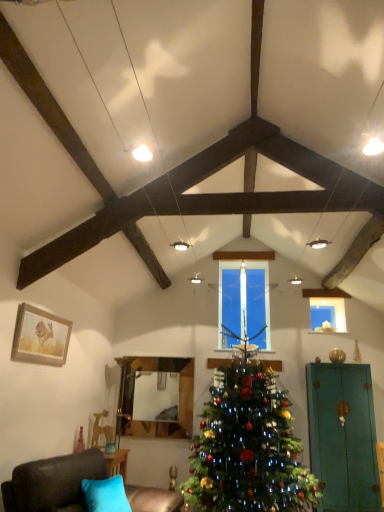
Question: From the image's perspective, is green matte christmas tree at center on transparent glass candle at upper center?

Choices:
 (A) yes
 (B) no

Answer: (B)

Question: Is transparent glass candle at upper center at the back of green matte christmas tree at center?

Choices:
 (A) no
 (B) yes

Answer: (A)

Question: Would you say green matte christmas tree at center is a long distance from transparent glass candle at upper center?

Choices:
 (A) yes
 (B) no

Answer: (A)

Question: Is green matte christmas tree at center taller than transparent glass candle at upper center?

Choices:
 (A) no
 (B) yes

Answer: (B)

Question: From a real-world perspective, is green matte christmas tree at center over transparent glass candle at upper center?

Choices:
 (A) no
 (B) yes

Answer: (A)

Question: Does green matte christmas tree at center have a smaller size compared to transparent glass candle at upper center?

Choices:
 (A) no
 (B) yes

Answer: (A)

Question: Can you confirm if teal matte armoire at right is positioned to the right of transparent glass candle at upper center?

Choices:
 (A) yes
 (B) no

Answer: (B)

Question: Is teal matte armoire at right facing towards transparent glass candle at upper center?

Choices:
 (A) yes
 (B) no

Answer: (B)

Question: From a real-world perspective, does teal matte armoire at right sit lower than transparent glass candle at upper center?

Choices:
 (A) no
 (B) yes

Answer: (B)

Question: Is teal matte armoire at right in front of transparent glass candle at upper center?

Choices:
 (A) yes
 (B) no

Answer: (A)

Question: Can you see teal matte armoire at right touching transparent glass candle at upper center?

Choices:
 (A) no
 (B) yes

Answer: (A)

Question: Is teal matte armoire at right smaller than transparent glass candle at upper center?

Choices:
 (A) no
 (B) yes

Answer: (A)

Question: From a real-world perspective, is wooden framed picture at left under clear glass candle at center?

Choices:
 (A) yes
 (B) no

Answer: (A)